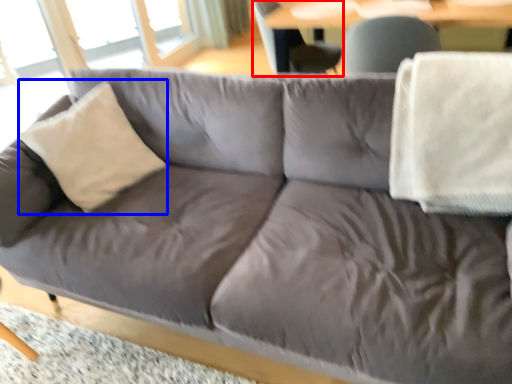
Question: Which point is closer to the camera, swivel chair (highlighted by a red box) or throw pillow (highlighted by a blue box)?

Choices:
 (A) swivel chair
 (B) throw pillow

Answer: (B)